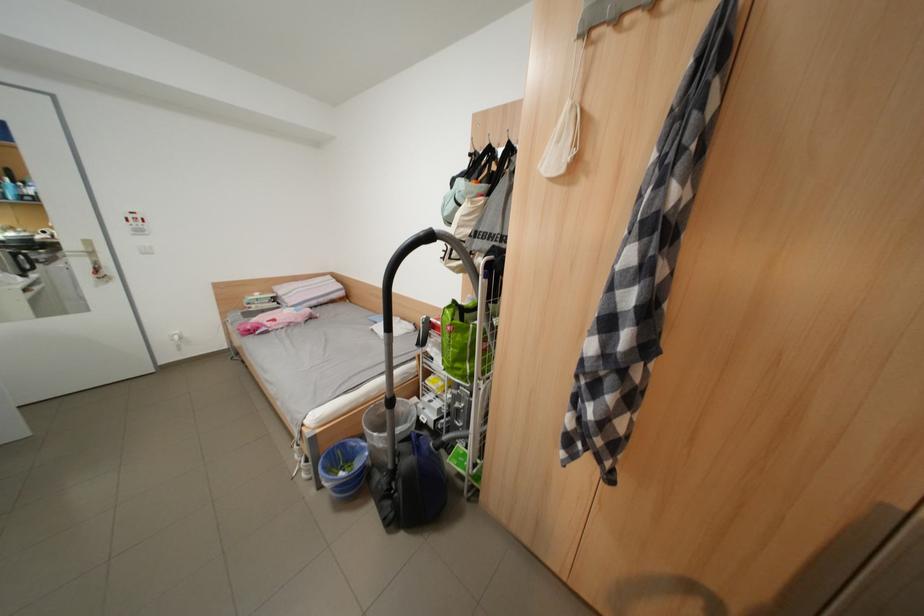
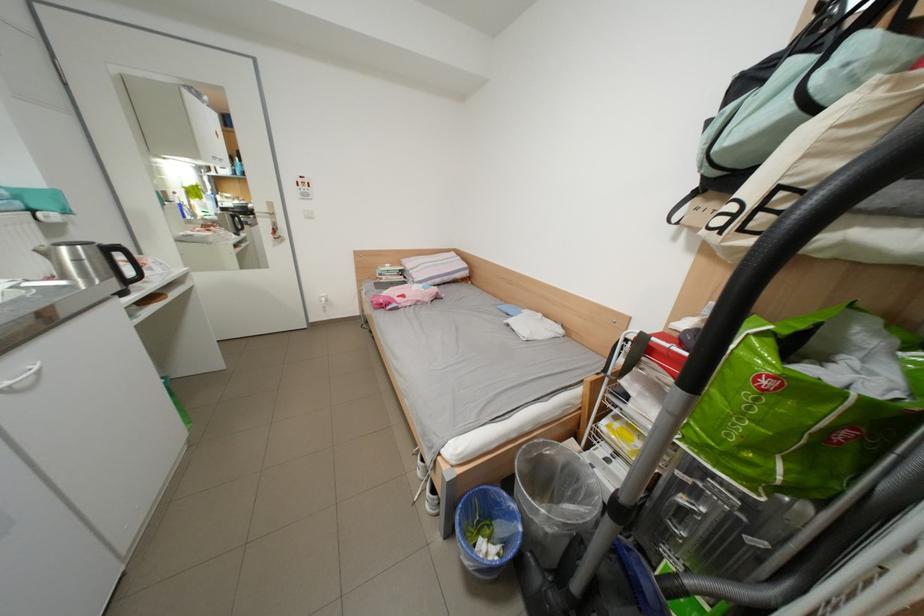
Find the pixel in the second image that matches (x=485, y=225) in the first image.

(877, 146)